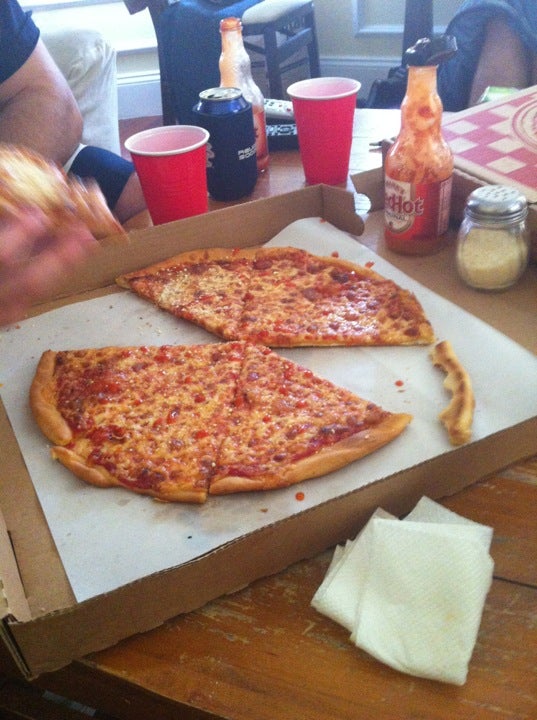
Find the location of a particular element. The height and width of the screenshot is (720, 537). cup is located at coordinates (190, 184).